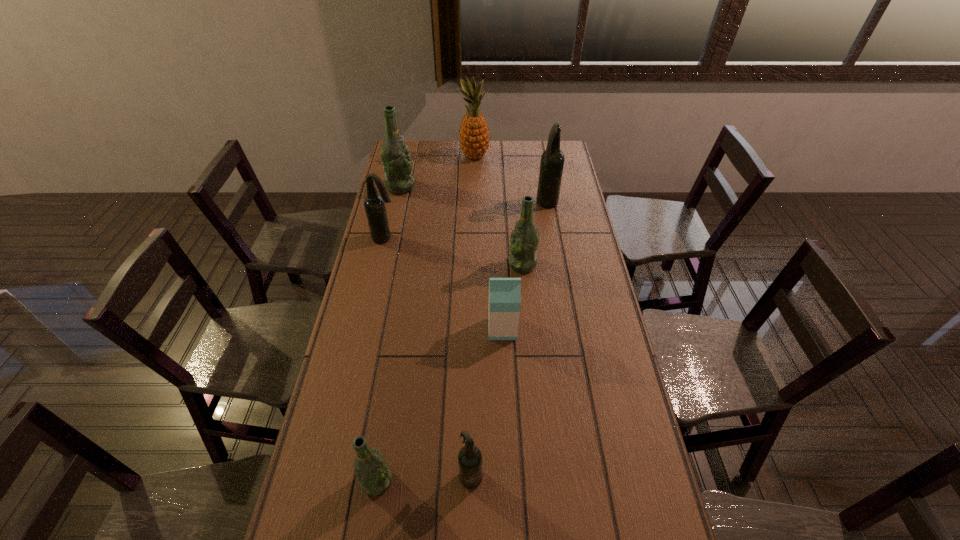
You are a GUI agent. You are given a task and a screenshot of the screen. Output one action in this format:
    pyautogui.click(x=<x>, y=<y>)
    Task: Click on the free spot located 0.390m on the back of the second smallest dark beer bottle
    This screenshot has width=960, height=540.
    Given the screenshot: What is the action you would take?
    pyautogui.click(x=398, y=178)

Locate an element on the screen. free location located 0.160m on the left of the milk carton is located at coordinates (440, 329).

Identify the location of free space located 0.340m on the left of the fourth beer bottle from left to right. This screenshot has height=540, width=960. (325, 475).

What are the coordinates of `free space located on the surface of the smallest green beer bottle` in the screenshot? It's located at (370, 524).

Locate an element on the screen. The width and height of the screenshot is (960, 540). object located at the far edge is located at coordinates (474, 137).

Find the location of a particular element. object at the right edge is located at coordinates (552, 160).

Locate an element on the screen. The image size is (960, 540). free space at the far edge of the desktop is located at coordinates (462, 157).

Image resolution: width=960 pixels, height=540 pixels. In the image, there is a desktop. Identify the location of vacant area at the left edge. (409, 238).

Image resolution: width=960 pixels, height=540 pixels. What are the coordinates of `free space at the right edge` in the screenshot? It's located at point(565,214).

Identify the location of free space that is in between the second dark beer bottle from left to right and the fourth farthest beer bottle. The height and width of the screenshot is (540, 960). (496, 369).